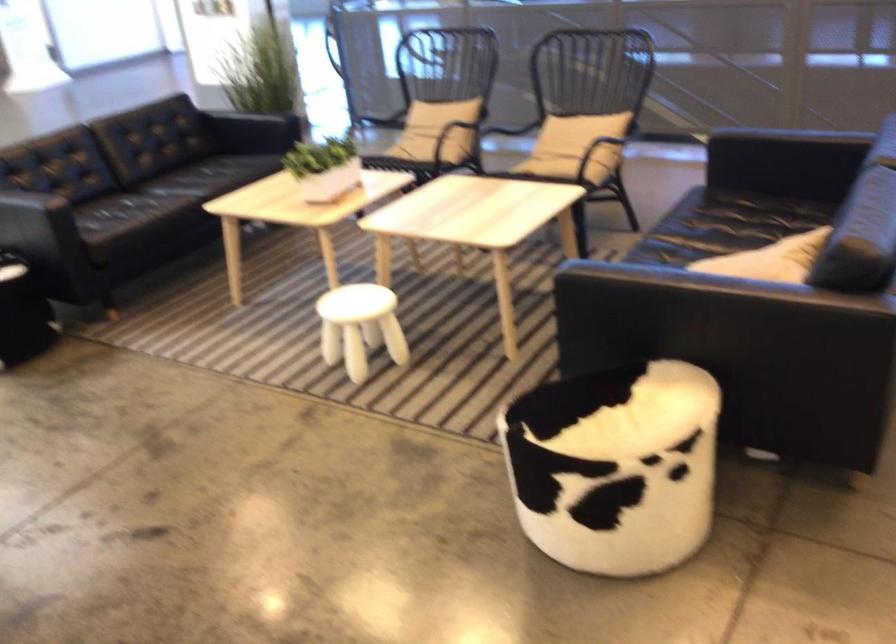
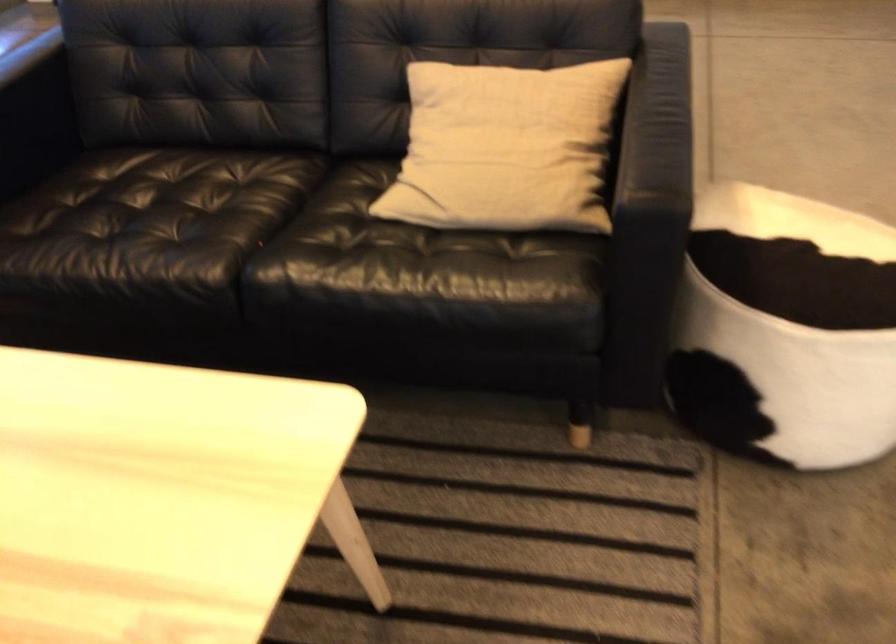
The point at (x=728, y=267) is marked in the first image. Where is the corresponding point in the second image?

(505, 147)